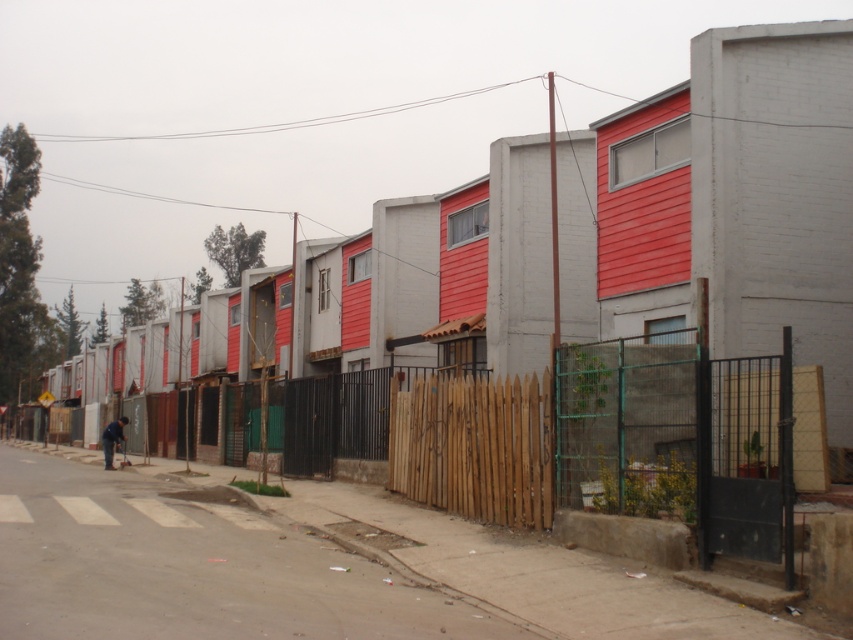
Who is positioned more to the right, concrete sidewalk at lower center or wooden fence at center?

wooden fence at center

Describe the element at coordinates (311, 570) in the screenshot. The width and height of the screenshot is (853, 640). I see `concrete sidewalk at lower center` at that location.

Is point (242, 528) positioned before point (682, 500)?

No, it is not.

Identify the location of concrete sidewalk at lower center. This screenshot has width=853, height=640. (311, 570).

Based on the photo, is concrete sidewalk at lower center shorter than brown wooden fence at center?

Yes, concrete sidewalk at lower center is shorter than brown wooden fence at center.

From the picture: Who is shorter, concrete sidewalk at lower center or brown wooden fence at center?

concrete sidewalk at lower center is shorter.

Is point (366, 620) closer to viewer compared to point (537, 406)?

Yes, it is.

The height and width of the screenshot is (640, 853). In order to click on concrete sidewalk at lower center in this screenshot , I will do `click(311, 570)`.

Who is taller, concrete sidewalk at lower center or dark blue jeans at lower left?

Standing taller between the two is dark blue jeans at lower left.

Who is more forward, (485, 605) or (111, 460)?

Point (485, 605) is more forward.

Identify the location of concrete sidewalk at lower center. This screenshot has width=853, height=640. (311, 570).